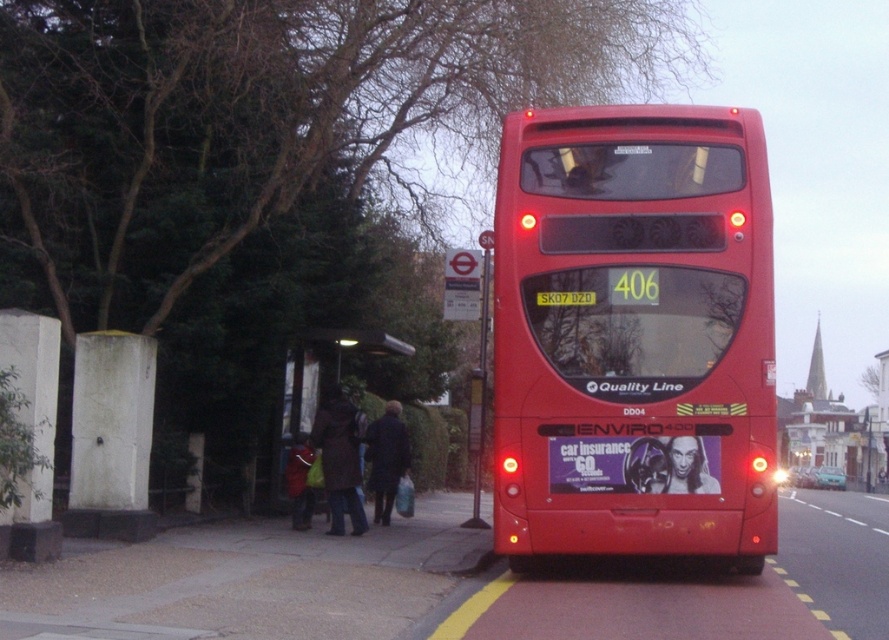
Question: Is matte red bus at center bigger than dark brown wooden bench at center?

Choices:
 (A) no
 (B) yes

Answer: (B)

Question: Which point appears farthest from the camera in this image?

Choices:
 (A) (597, 296)
 (B) (300, 365)

Answer: (B)

Question: Is matte red bus at center further to the viewer compared to dark brown wooden bench at center?

Choices:
 (A) yes
 (B) no

Answer: (B)

Question: Among these points, which one is farthest from the camera?

Choices:
 (A) (637, 456)
 (B) (295, 396)

Answer: (B)

Question: Can you confirm if matte red bus at center is bigger than dark brown wooden bench at center?

Choices:
 (A) yes
 (B) no

Answer: (A)

Question: Which point is closer to the camera?

Choices:
 (A) matte red bus at center
 (B) dark brown wooden bench at center

Answer: (A)